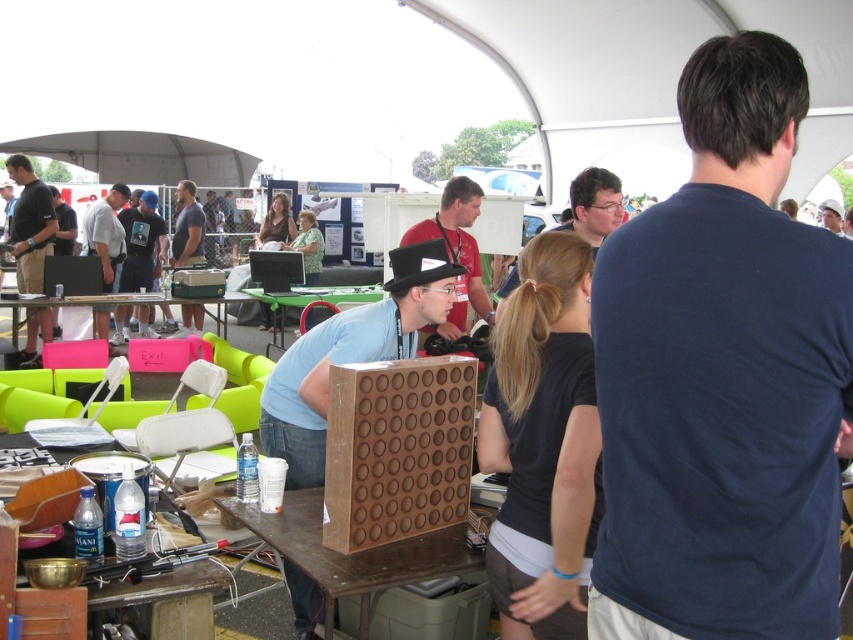
Question: Which of the following is the farthest from the observer?

Choices:
 (A) (589, 184)
 (B) (215, 499)

Answer: (A)

Question: From the image, what is the correct spatial relationship of dark blue t-shirt at upper right in relation to wooden game board at center?

Choices:
 (A) below
 (B) above

Answer: (B)

Question: Which point appears farthest from the camera in this image?

Choices:
 (A) (187, 236)
 (B) (16, 307)
 (C) (358, 294)

Answer: (A)

Question: Does matte black t-shirt at center have a smaller size compared to pink foam couch at lower left?

Choices:
 (A) yes
 (B) no

Answer: (B)

Question: Where is matte black t-shirt at center located in relation to light gray t-shirt at left in the image?

Choices:
 (A) above
 (B) below

Answer: (A)

Question: Considering the real-world distances, which object is farthest from the matte black t-shirt at center?

Choices:
 (A) light gray t-shirt at left
 (B) dark blue t-shirt at center
 (C) matte black shirt at left
 (D) matte black shirt at center

Answer: (D)